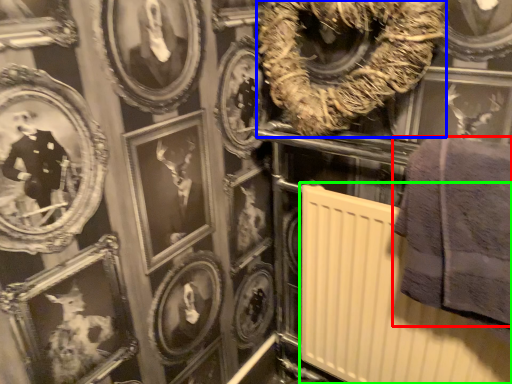
Question: Which is nearer to the towel (highlighted by a red box)? decor (highlighted by a blue box) or radiator (highlighted by a green box).

Choices:
 (A) decor
 (B) radiator

Answer: (B)